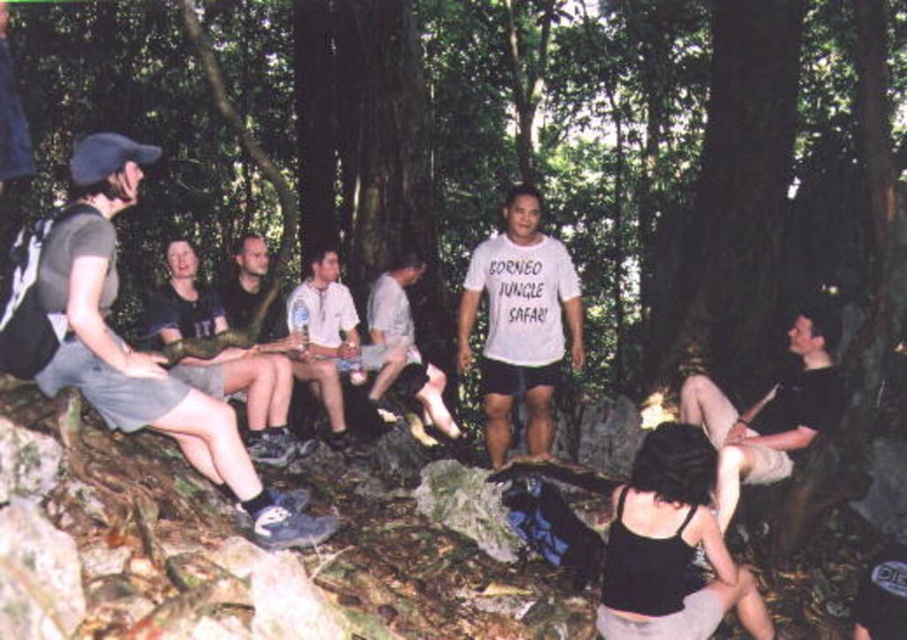
Can you confirm if camouflage fabric snake at center is thinner than white cotton shirt at center?

Yes, camouflage fabric snake at center is thinner than white cotton shirt at center.

Can you confirm if camouflage fabric snake at center is wider than white cotton shirt at center?

No, camouflage fabric snake at center is not wider than white cotton shirt at center.

Where is `camouflage fabric snake at center`? The image size is (907, 640). camouflage fabric snake at center is located at coordinates (252, 396).

Which is above, dark gray fabric shorts at left or white cotton shirt at center?

white cotton shirt at center is above.

Can you confirm if dark gray fabric shorts at left is smaller than white cotton shirt at center?

Incorrect, dark gray fabric shorts at left is not smaller in size than white cotton shirt at center.

At what (x,y) coordinates should I click in order to perform the action: click on dark gray fabric shorts at left. Please return your answer as a coordinate pair (x, y). This screenshot has height=640, width=907. Looking at the image, I should click on (123, 340).

Find the location of a particular element. The width and height of the screenshot is (907, 640). dark gray fabric shorts at left is located at coordinates (123, 340).

Between point (831, 417) and point (155, 304), which one is positioned in front?

Point (831, 417) is in front.

Measure the distance from black cotton shirt at lower right to camouflage fabric snake at center.

They are 3.22 meters apart.

Who is more forward, (795, 397) or (189, 320)?

Point (795, 397)

Locate an element on the screen. black cotton shirt at lower right is located at coordinates (767, 413).